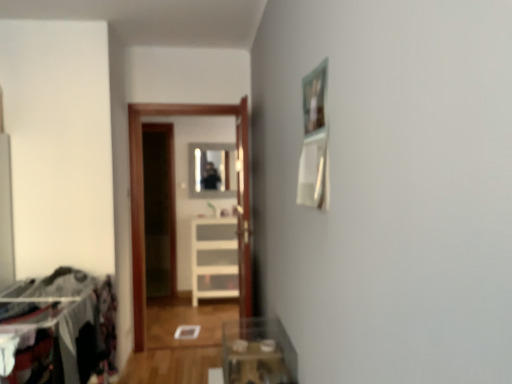
Question: Is clear glass table at lower center bigger than white plastic drawer at center?

Choices:
 (A) no
 (B) yes

Answer: (A)

Question: From the image's perspective, is clear glass table at lower center beneath white plastic drawer at center?

Choices:
 (A) yes
 (B) no

Answer: (A)

Question: Is white plastic drawer at center at the back of clear glass table at lower center?

Choices:
 (A) no
 (B) yes

Answer: (A)

Question: Can you confirm if clear glass table at lower center is positioned to the left of white plastic drawer at center?

Choices:
 (A) yes
 (B) no

Answer: (B)

Question: Is clear glass table at lower center shorter than white plastic drawer at center?

Choices:
 (A) yes
 (B) no

Answer: (A)

Question: In the image, is clear glass mirror at center on the left side or the right side of dark fabric laundry at left?

Choices:
 (A) left
 (B) right

Answer: (B)

Question: From the image's perspective, is clear glass mirror at center located above or below dark fabric laundry at left?

Choices:
 (A) below
 (B) above

Answer: (B)

Question: Is clear glass mirror at center in front of or behind dark fabric laundry at left in the image?

Choices:
 (A) behind
 (B) front

Answer: (A)

Question: Considering the positions of clear glass mirror at center and dark fabric laundry at left in the image, is clear glass mirror at center wider or thinner than dark fabric laundry at left?

Choices:
 (A) thin
 (B) wide

Answer: (A)

Question: Relative to white plastic drawer at center, is clear glass table at lower center in front or behind?

Choices:
 (A) behind
 (B) front

Answer: (B)

Question: Based on their positions, is clear glass table at lower center located to the left or right of white plastic drawer at center?

Choices:
 (A) right
 (B) left

Answer: (A)

Question: Which is correct: clear glass table at lower center is inside white plastic drawer at center, or outside of it?

Choices:
 (A) outside
 (B) inside

Answer: (A)

Question: From their relative heights in the image, would you say clear glass table at lower center is taller or shorter than white plastic drawer at center?

Choices:
 (A) tall
 (B) short

Answer: (B)

Question: From a real-world perspective, is clear glass table at lower center positioned above or below dark fabric laundry at left?

Choices:
 (A) below
 (B) above

Answer: (B)

Question: Is clear glass table at lower center in front of or behind dark fabric laundry at left in the image?

Choices:
 (A) front
 (B) behind

Answer: (A)